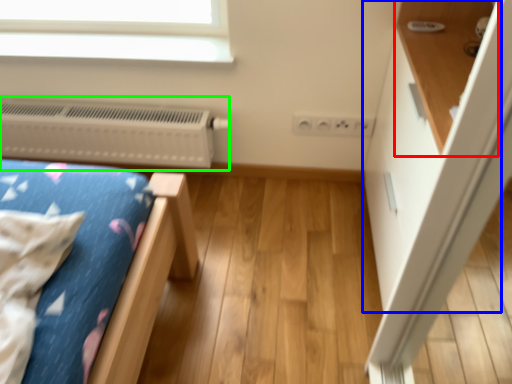
Question: Which is nearer to the shelf (highlighted by a red box)? dresser (highlighted by a blue box) or heater (highlighted by a green box).

Choices:
 (A) dresser
 (B) heater

Answer: (A)